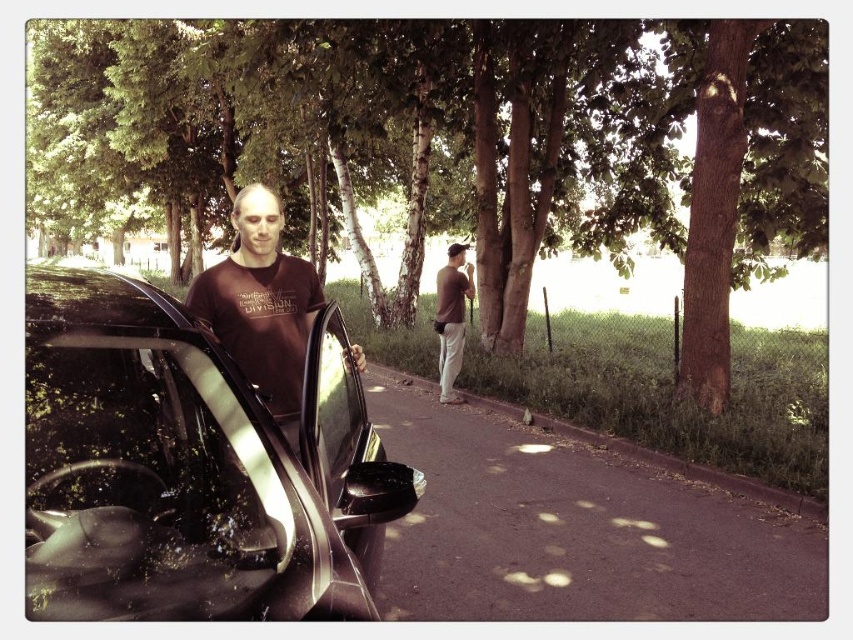
From the picture: You are a pedestrian walking along the paved path and want to reach the shiny black car at left without stepping on the grass. Which direction should you move relative to the brown textured tree at center?

The brown textured tree at center is positioned on the left side of the shiny black car at left. To reach the shiny black car at left without stepping on the grass, you should move to the right side of the brown textured tree at center since the car is to its right.